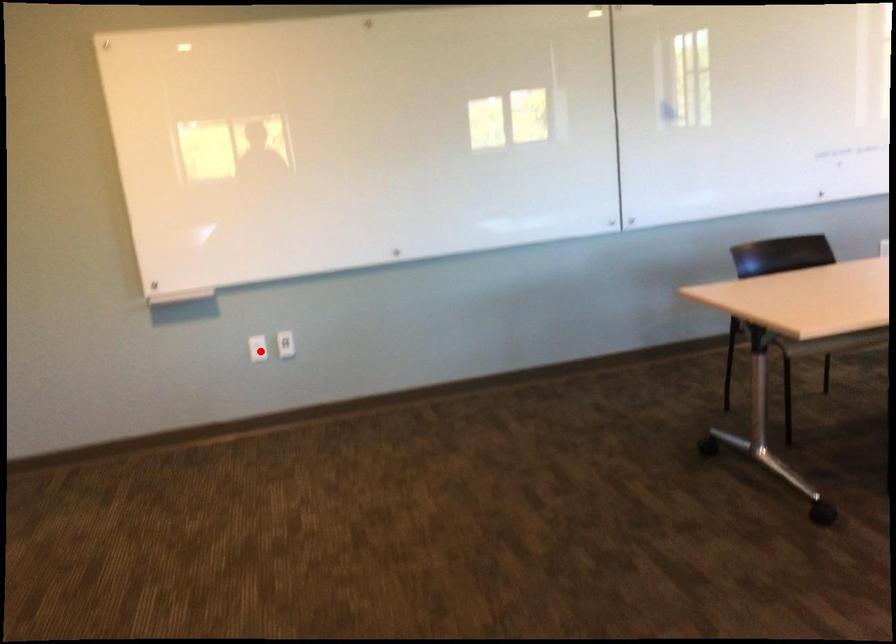
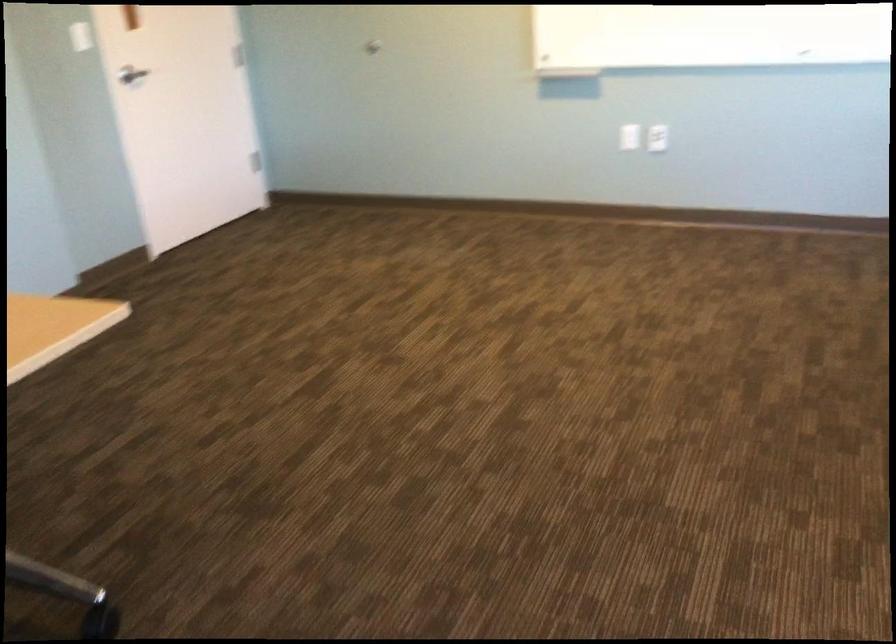
Find the pixel in the second image that matches the highlighted location in the first image.

(629, 137)